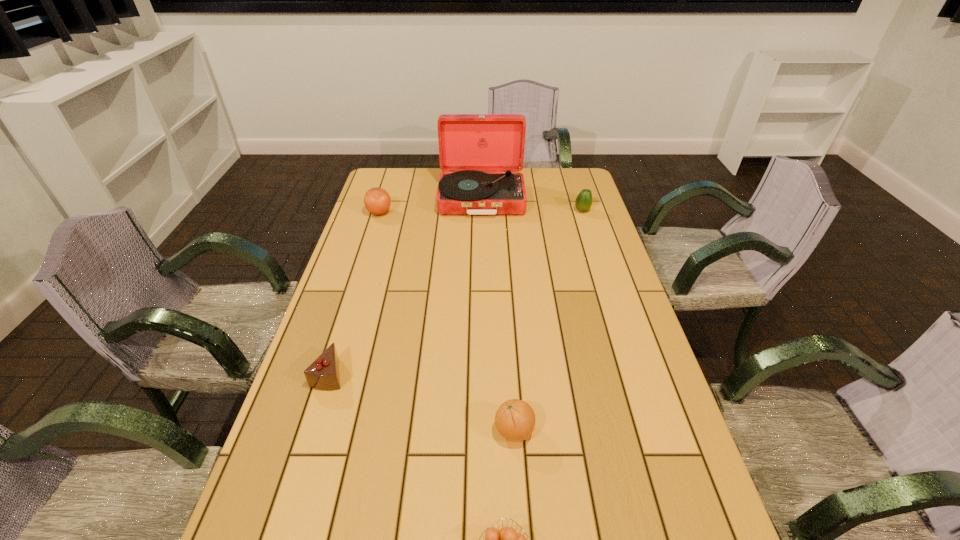
This screenshot has height=540, width=960. I want to click on free point located on the left of the second nearest orange fruit, so click(x=325, y=430).

The height and width of the screenshot is (540, 960). Find the location of `vacant space situated on the back of the third nearest object`. vacant space situated on the back of the third nearest object is located at coordinates (348, 316).

Image resolution: width=960 pixels, height=540 pixels. Find the location of `object located at the far edge`. object located at the far edge is located at coordinates (481, 155).

Find the location of a particular element. Image resolution: width=960 pixels, height=540 pixels. orange that is at the left edge is located at coordinates (377, 201).

Locate an element on the screen. This screenshot has width=960, height=540. chocolate cake at the left edge is located at coordinates (323, 374).

Where is `object at the right edge`? object at the right edge is located at coordinates (583, 202).

In the image, there is a desktop. Find the location of `vacant space at the far edge`. vacant space at the far edge is located at coordinates (417, 168).

Identify the location of vacant area at the left edge of the desktop. The width and height of the screenshot is (960, 540). (360, 323).

The image size is (960, 540). In the image, there is a desktop. In order to click on free space at the right edge in this screenshot , I will do `click(603, 318)`.

The height and width of the screenshot is (540, 960). Find the location of `free point at the far left corner`. free point at the far left corner is located at coordinates (398, 180).